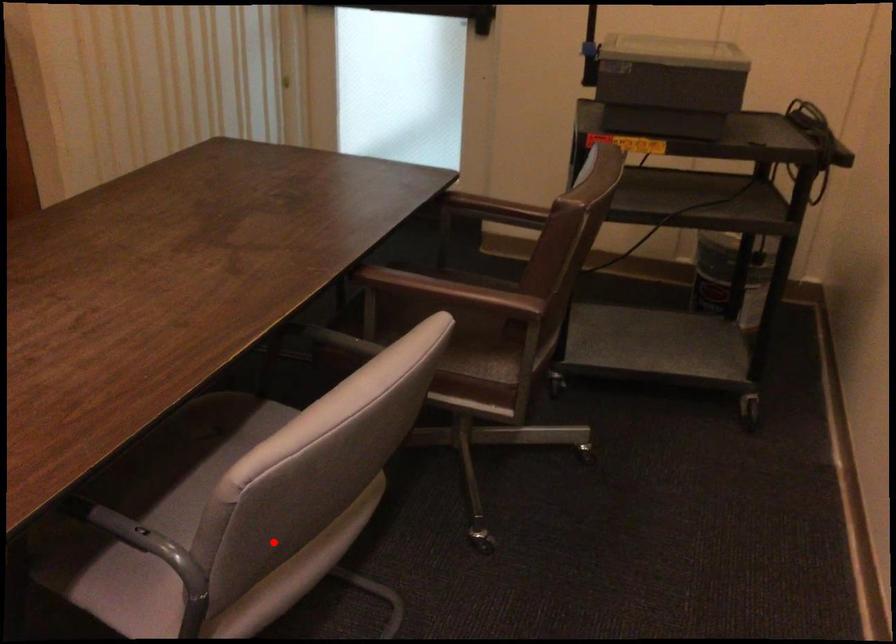
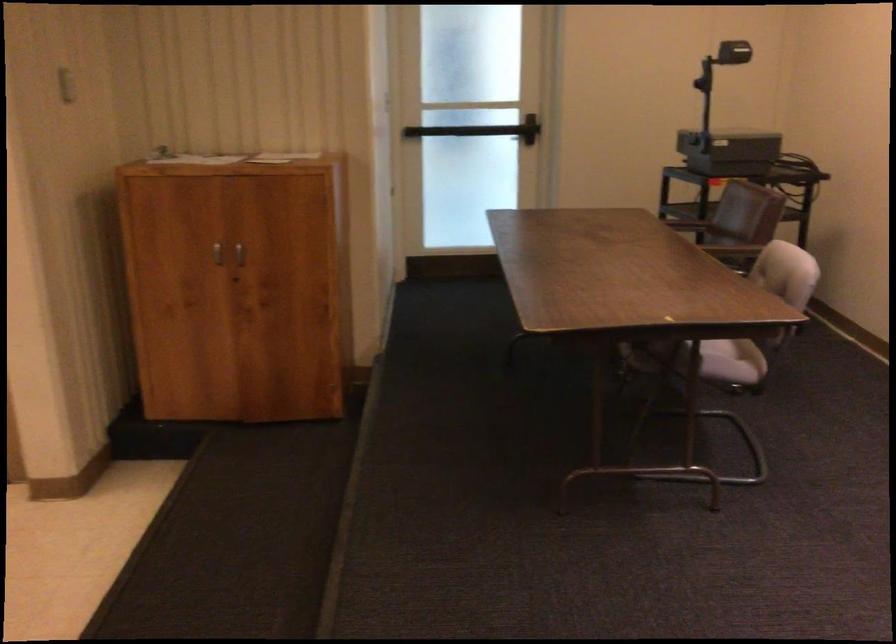
In the second image, find the point that corresponds to the highlighted location in the first image.

(737, 348)